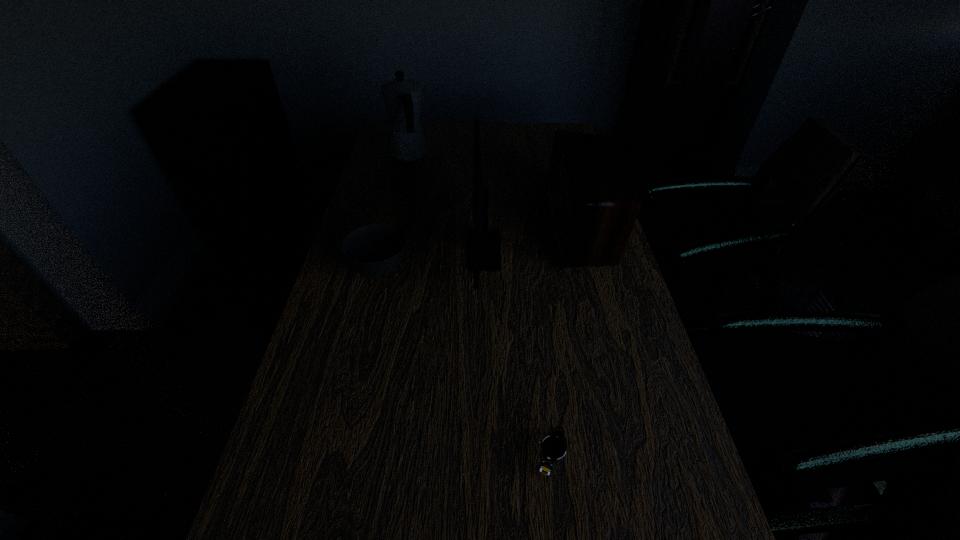
Image resolution: width=960 pixels, height=540 pixels. In order to click on vacant area situated 0.300m on the screen side of the computer monitor in this screenshot , I will do `click(363, 251)`.

You are a GUI agent. You are given a task and a screenshot of the screen. Output one action in this format:
    pyautogui.click(x=<x>, y=<y>)
    Task: Click on the free point located 0.170m on the front-facing side of the third shortest object
    
    Given the screenshot: What is the action you would take?
    pyautogui.click(x=493, y=228)

Identify the location of vacant region located 0.360m on the front-facing side of the third shortest object. (430, 228).

This screenshot has width=960, height=540. Identify the location of free location located on the front-facing side of the third shortest object. pyautogui.click(x=520, y=228).

Where is `free space located on the right of the bowl`? This screenshot has width=960, height=540. free space located on the right of the bowl is located at coordinates (458, 269).

Locate an element on the screen. blank area located on the back of the second object from right to left is located at coordinates (536, 324).

Find the location of a particular element. Image resolution: width=960 pixels, height=540 pixels. object at the far edge is located at coordinates (402, 98).

Locate an element on the screen. The width and height of the screenshot is (960, 540). coffeepot present at the left edge is located at coordinates (402, 98).

Identify the location of bowl located at the left edge. This screenshot has width=960, height=540. (375, 250).

At what (x,y) coordinates should I click in order to perform the action: click on object that is at the right edge. Please return your answer as a coordinate pair (x, y). Image resolution: width=960 pixels, height=540 pixels. Looking at the image, I should click on (592, 203).